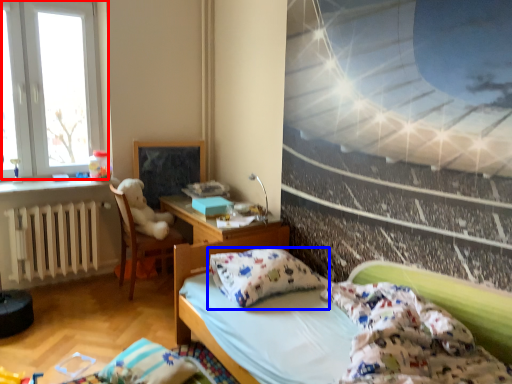
Question: Which object appears farthest to the camera in this image, window (highlighted by a red box) or pillow (highlighted by a blue box)?

Choices:
 (A) window
 (B) pillow

Answer: (A)